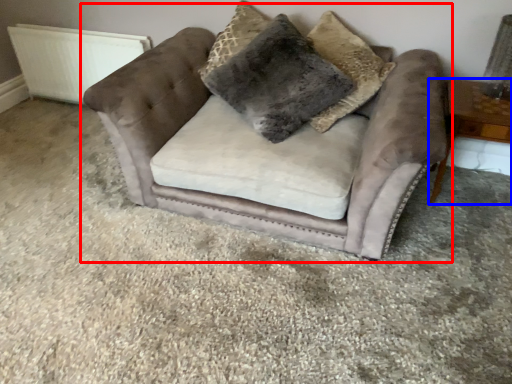
Question: Which object appears closest to the camera in this image, chair (highlighted by a red box) or table (highlighted by a blue box)?

Choices:
 (A) chair
 (B) table

Answer: (A)